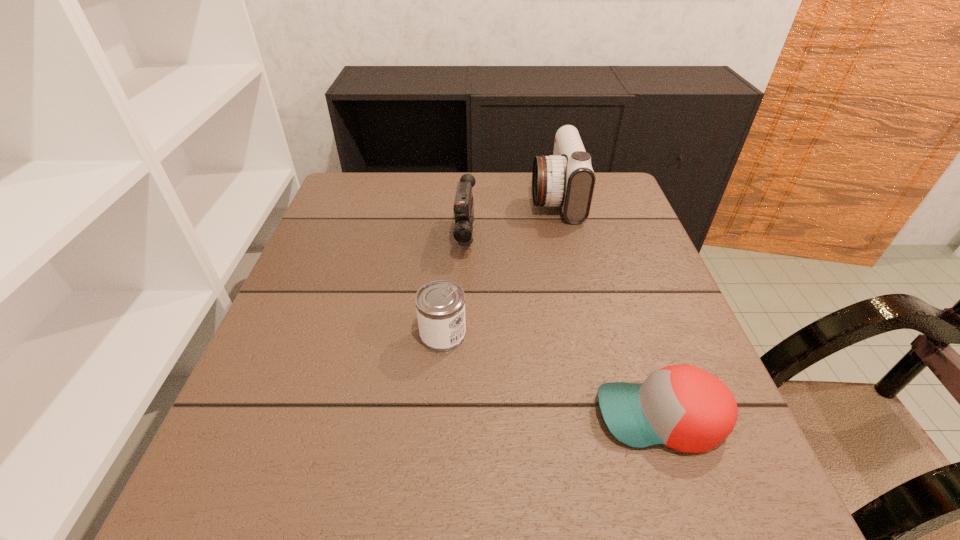
The height and width of the screenshot is (540, 960). What are the coordinates of `the taller camcorder` in the screenshot? It's located at (566, 178).

Identify the location of the right camcorder. This screenshot has width=960, height=540. (x=566, y=178).

This screenshot has width=960, height=540. Find the location of `the left camcorder`. the left camcorder is located at coordinates (463, 208).

Locate an element on the screen. The width and height of the screenshot is (960, 540). the shorter camcorder is located at coordinates (463, 208).

This screenshot has width=960, height=540. Identify the location of the third tallest object. (440, 305).

Locate an element on the screen. the second nearest object is located at coordinates (440, 305).

In order to click on the shortest object in this screenshot , I will do `click(683, 407)`.

The height and width of the screenshot is (540, 960). Identify the location of the nearest object. pyautogui.click(x=683, y=407).

Find the location of a particular element. This screenshot has width=960, height=540. vacant space located 0.150m on the surface of the taller camcorder is located at coordinates (478, 198).

Identify the location of vacant area located on the surface of the taller camcorder. The image size is (960, 540). (464, 198).